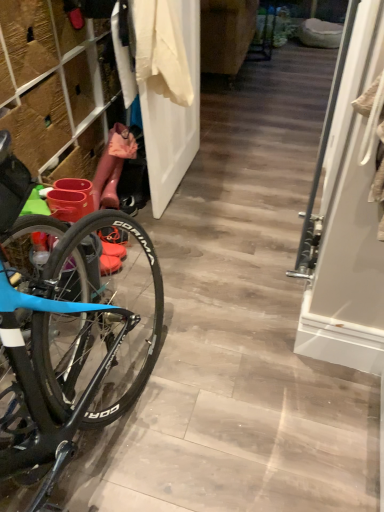
Question: Does point (183, 76) appear closer or farther from the camera than point (367, 112)?

Choices:
 (A) farther
 (B) closer

Answer: (A)

Question: Is white cotton shirt at upper center wider or thinner than white glossy screen door at right?

Choices:
 (A) wide
 (B) thin

Answer: (A)

Question: Considering the real-world distances, which object is farthest from the rubber boots at left?

Choices:
 (A) white cotton shirt at upper center
 (B) white glossy screen door at right
 (C) white matte door at center

Answer: (B)

Question: Considering the real-world distances, which object is farthest from the white cotton shirt at upper center?

Choices:
 (A) rubber boots at left
 (B) white matte door at center
 (C) white glossy screen door at right

Answer: (C)